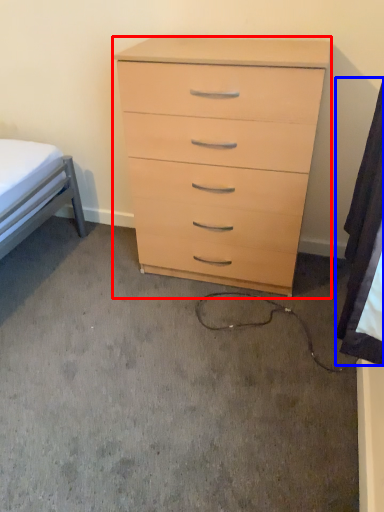
Question: Which object appears farthest to the camera in this image, chest of drawers (highlighted by a red box) or sheet (highlighted by a blue box)?

Choices:
 (A) chest of drawers
 (B) sheet

Answer: (A)